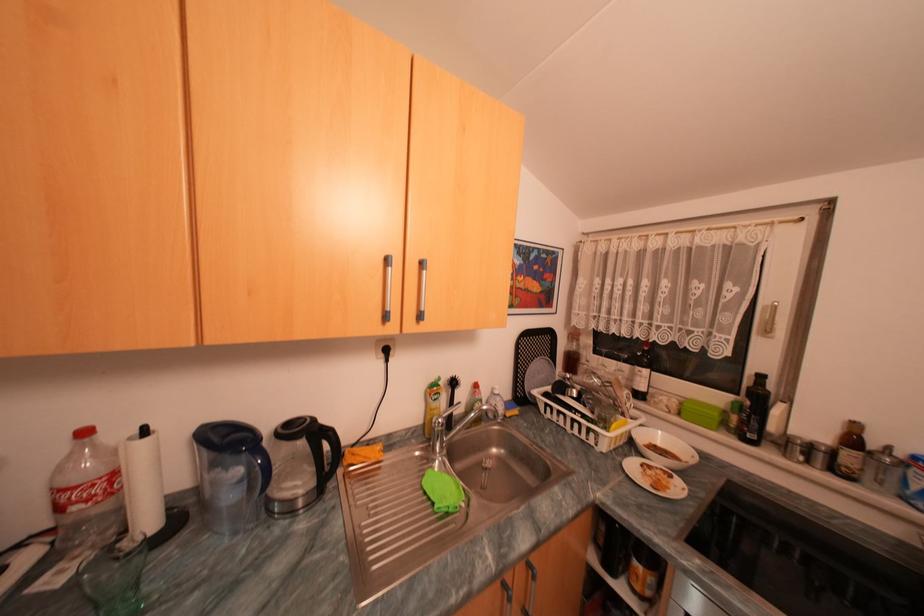
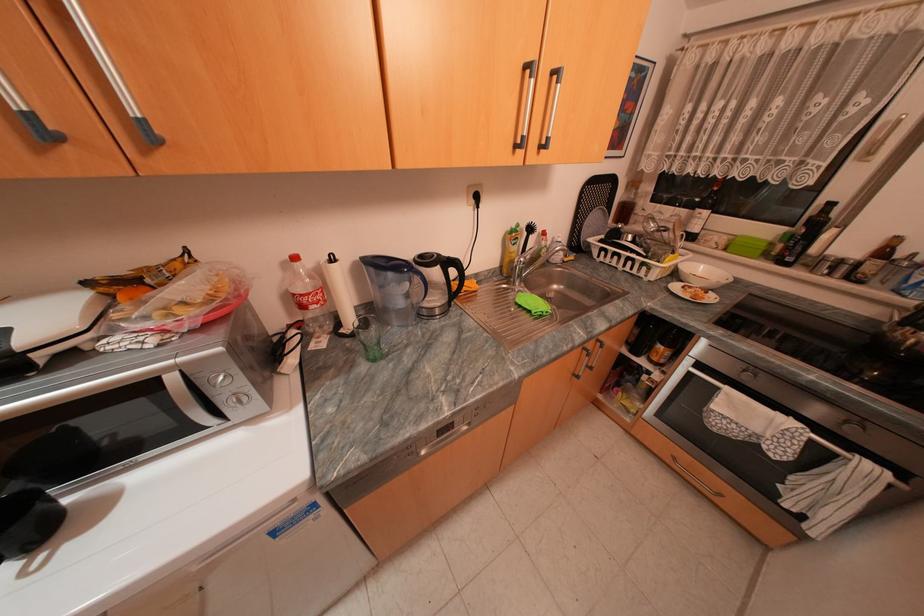
The point at (640, 445) is marked in the first image. Where is the corresponding point in the second image?

(685, 275)